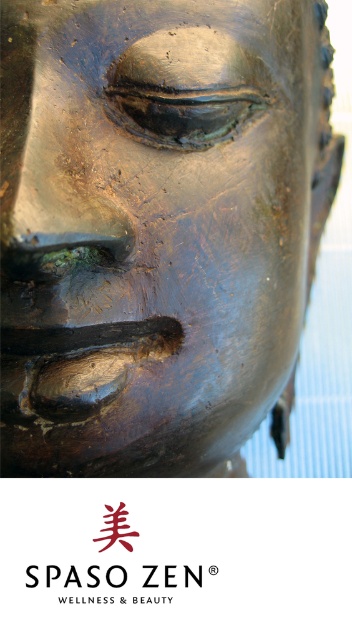
Describe the element at coordinates (156, 227) in the screenshot. This screenshot has height=640, width=352. I see `bronze sculpture at center` at that location.

Is bronze sculpture at center bigger than black matte text at center?

Yes, bronze sculpture at center is bigger than black matte text at center.

Image resolution: width=352 pixels, height=640 pixels. What are the coordinates of `bronze sculpture at center` in the screenshot? It's located at (156, 227).

This screenshot has width=352, height=640. I want to click on bronze sculpture at center, so click(156, 227).